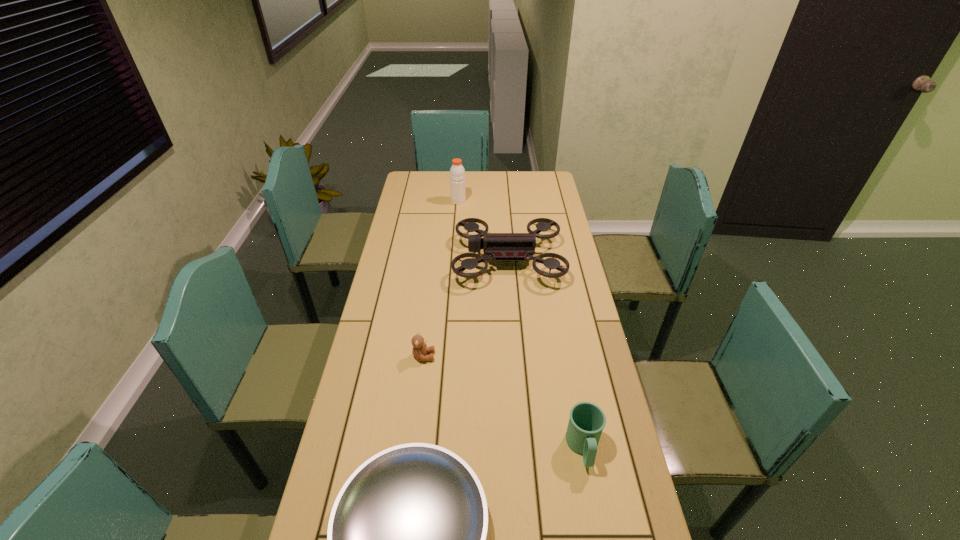
Image resolution: width=960 pixels, height=540 pixels. Identify the location of blank region between the mug and the teddy bear. (503, 402).

You are a GUI agent. You are given a task and a screenshot of the screen. Output one action in this format:
    pyautogui.click(x=<x>, y=<y>)
    Task: Click on the empty space that is in between the teddy bear and the mug
    The image size is (960, 540).
    Given the screenshot: What is the action you would take?
    pyautogui.click(x=503, y=402)

You are a GUI agent. You are given a task and a screenshot of the screen. Output one action in this format:
    pyautogui.click(x=<x>, y=<y>)
    Task: Click on the vacant region between the mug and the second shortest object
    The height and width of the screenshot is (540, 960).
    Given the screenshot: What is the action you would take?
    pyautogui.click(x=503, y=402)

Find the location of a particular element. free space between the tallest object and the teddy bear is located at coordinates (441, 279).

Locate an element on the screen. This screenshot has height=540, width=960. free space between the fourth tallest object and the tallest object is located at coordinates (441, 279).

The image size is (960, 540). I want to click on the fourth closest object relative to the shortest object, so click(x=457, y=172).

Where is `object that can be found as the third closest to the teddy bear`? object that can be found as the third closest to the teddy bear is located at coordinates (587, 421).